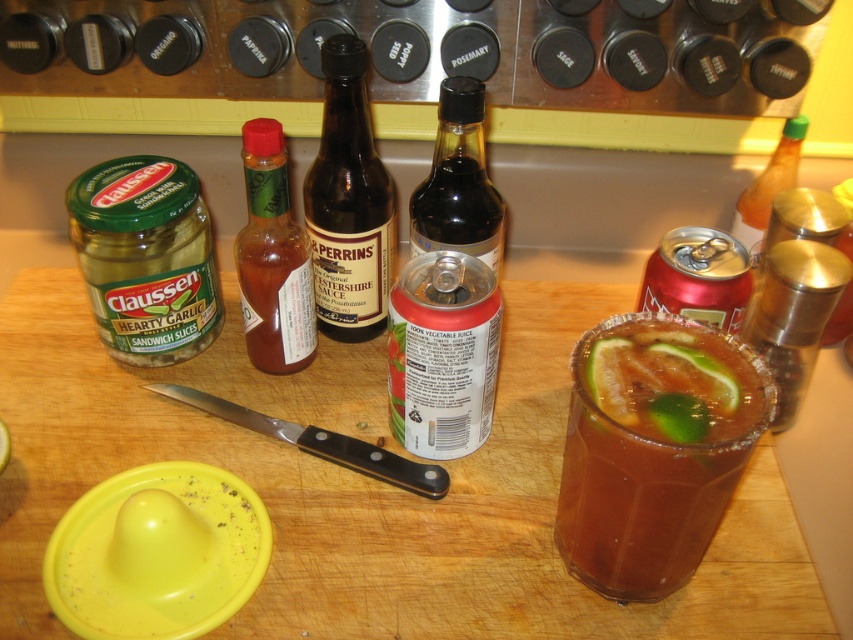
Who is more forward, [251,349] or [454,186]?

Point [454,186] is in front.

Is translucent glass hot sauce at center in front of black glass bottle at center?

That is False.

Identify the location of translucent glass hot sauce at center. This screenshot has width=853, height=640. (271, 259).

What are the coordinates of `translucent glass hot sauce at center` in the screenshot? It's located at (271, 259).

Does wooden cutting board at center appear under brown glass bottle at center?

Correct, wooden cutting board at center is located below brown glass bottle at center.

Does point (405, 502) come closer to viewer compared to point (329, 292)?

Yes, point (405, 502) is in front of point (329, 292).

This screenshot has width=853, height=640. What do you see at coordinates (370, 486) in the screenshot?
I see `wooden cutting board at center` at bounding box center [370, 486].

Find the location of a particular element. This screenshot has height=640, width=853. wooden cutting board at center is located at coordinates (370, 486).

Who is more distant from viewer, (753,582) or (287,333)?

The point (287,333) is behind.

Is point (209, 433) behind point (265, 321)?

No, it is not.

Where is `wooden cutting board at center`? Image resolution: width=853 pixels, height=640 pixels. wooden cutting board at center is located at coordinates (370, 486).